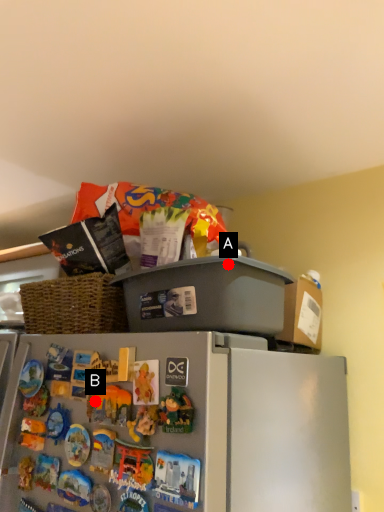
Question: Two points are circled on the image, labeled by A and B beside each circle. Among these points, which one is nearest to the camera?

Choices:
 (A) A is closer
 (B) B is closer

Answer: (A)